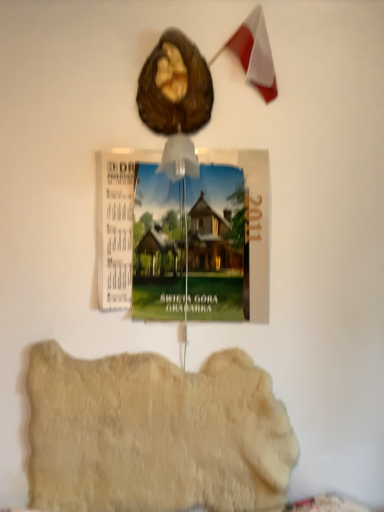
Question: Is shiny brown nut at upper center far from fuzzy beige rug at lower center?

Choices:
 (A) no
 (B) yes

Answer: (B)

Question: Does shiny brown nut at upper center have a lesser height compared to fuzzy beige rug at lower center?

Choices:
 (A) yes
 (B) no

Answer: (A)

Question: Is shiny brown nut at upper center touching fuzzy beige rug at lower center?

Choices:
 (A) no
 (B) yes

Answer: (A)

Question: Does shiny brown nut at upper center have a smaller size compared to fuzzy beige rug at lower center?

Choices:
 (A) yes
 (B) no

Answer: (A)

Question: Can you confirm if shiny brown nut at upper center is taller than fuzzy beige rug at lower center?

Choices:
 (A) yes
 (B) no

Answer: (B)

Question: Does shiny brown nut at upper center contain fuzzy beige rug at lower center?

Choices:
 (A) yes
 (B) no

Answer: (B)

Question: Is wooden postcard at center further to camera compared to shiny brown nut at upper center?

Choices:
 (A) yes
 (B) no

Answer: (A)

Question: From a real-world perspective, is wooden postcard at center under shiny brown nut at upper center?

Choices:
 (A) no
 (B) yes

Answer: (B)

Question: Is wooden postcard at center surrounding shiny brown nut at upper center?

Choices:
 (A) no
 (B) yes

Answer: (A)

Question: Is wooden postcard at center in front of shiny brown nut at upper center?

Choices:
 (A) no
 (B) yes

Answer: (A)

Question: From the image's perspective, does wooden postcard at center appear higher than shiny brown nut at upper center?

Choices:
 (A) yes
 (B) no

Answer: (B)

Question: Can you confirm if wooden postcard at center is thinner than shiny brown nut at upper center?

Choices:
 (A) no
 (B) yes

Answer: (B)

Question: Is wooden postcard at center shorter than fuzzy beige rug at lower center?

Choices:
 (A) no
 (B) yes

Answer: (A)